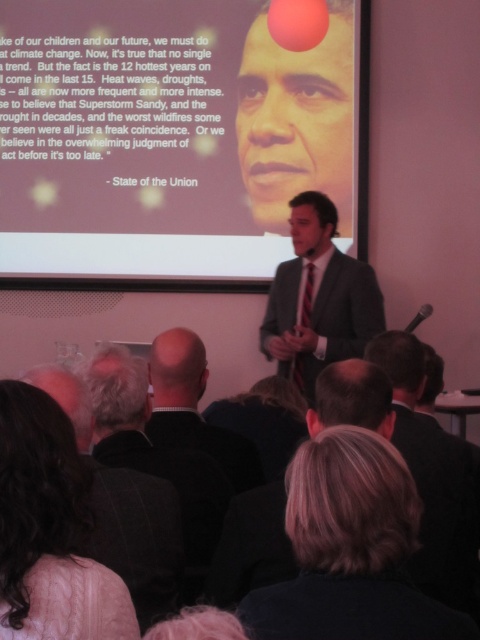
Looking at this image, is white matte projection screen at upper center to the left of blonde hair at center from the viewer's perspective?

Correct, you'll find white matte projection screen at upper center to the left of blonde hair at center.

Can you confirm if white matte projection screen at upper center is positioned above blonde hair at center?

Yes, white matte projection screen at upper center is above blonde hair at center.

Is point (325, 100) positioned after point (276, 586)?

Yes, it is behind point (276, 586).

Identify the location of white matte projection screen at upper center. The width and height of the screenshot is (480, 640). click(172, 136).

Does white knitted sweater at lower left lie in front of gray suit at center?

Yes, it is.

Between white knitted sweater at lower left and gray suit at center, which one is positioned higher?

Positioned higher is gray suit at center.

Who is more forward, (x=20, y=484) or (x=301, y=285)?

Point (x=20, y=484) is in front.

The image size is (480, 640). What are the coordinates of `white knitted sweater at lower left` in the screenshot? It's located at (49, 531).

Is blonde hair at center below gray suit at center?

Correct, blonde hair at center is located below gray suit at center.

Between blonde hair at center and gray suit at center, which one has more height?

gray suit at center is taller.

Find the location of `blonde hair at center`. blonde hair at center is located at coordinates (349, 548).